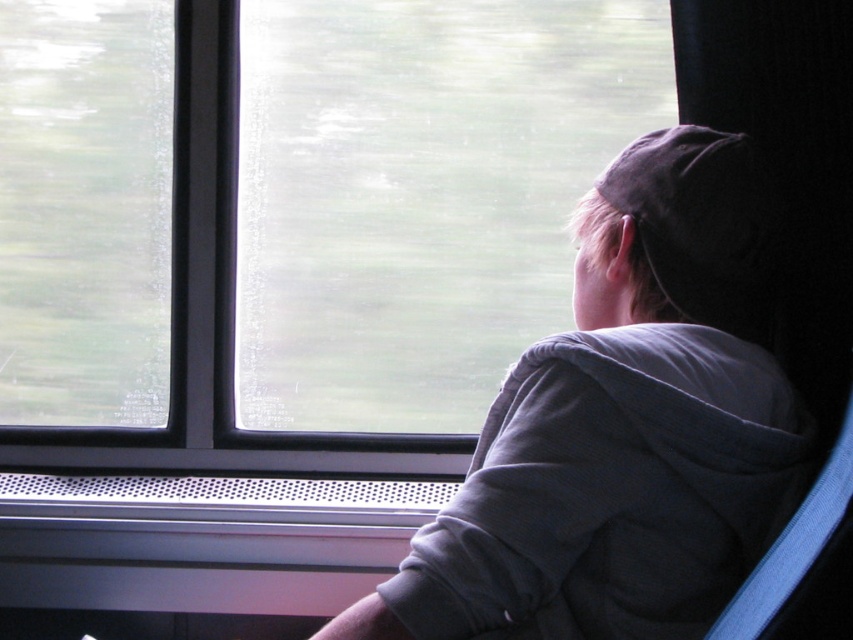
Question: Can you confirm if gray fleece jacket at upper right is wider than transparent glass window at upper left?

Choices:
 (A) yes
 (B) no

Answer: (A)

Question: Observing the image, what is the correct spatial positioning of transparent glass window at upper left in reference to dark gray fabric baseball hat at upper right?

Choices:
 (A) below
 (B) above

Answer: (B)

Question: Among these objects, which one is nearest to the camera?

Choices:
 (A) dark gray fabric baseball hat at upper right
 (B) transparent glass window at upper left
 (C) gray fleece jacket at upper right

Answer: (C)

Question: Does gray fleece jacket at upper right have a lesser width compared to transparent glass window at upper left?

Choices:
 (A) yes
 (B) no

Answer: (B)

Question: Which object is closer to the camera taking this photo?

Choices:
 (A) dark gray fabric baseball hat at upper right
 (B) transparent glass window at upper left

Answer: (A)

Question: Which of these objects is positioned closest to the gray fleece jacket at upper right?

Choices:
 (A) transparent glass window at upper left
 (B) dark gray fabric baseball hat at upper right

Answer: (B)